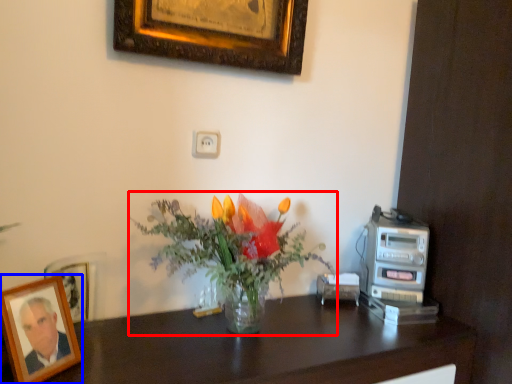
Question: Which point is closer to the camera, flower (highlighted by a red box) or picture frame (highlighted by a blue box)?

Choices:
 (A) flower
 (B) picture frame

Answer: (B)